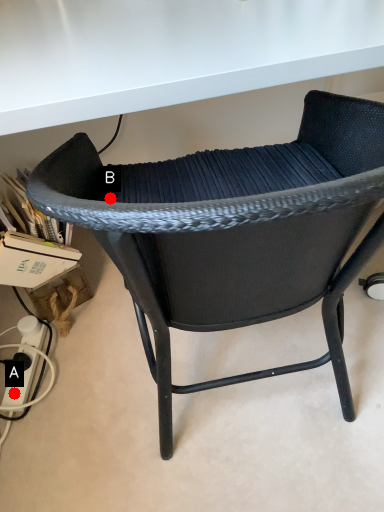
Question: Two points are circled on the image, labeled by A and B beside each circle. Which point appears closest to the camera in this image?

Choices:
 (A) A is closer
 (B) B is closer

Answer: (B)